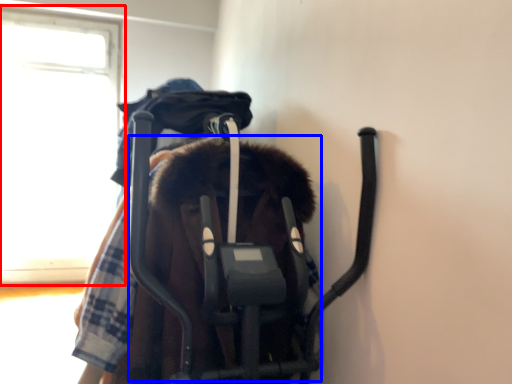
Question: Which point is further to the camera, window (highlighted by a red box) or baby elephant (highlighted by a blue box)?

Choices:
 (A) window
 (B) baby elephant

Answer: (A)